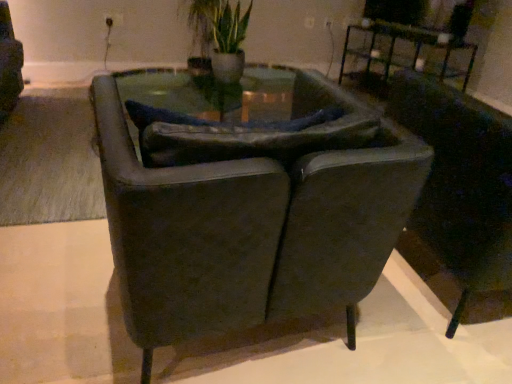
Question: From a real-world perspective, is suede-like dark brown armchair at center, the first chair viewed from the left, beneath green leafy plant at upper center?

Choices:
 (A) yes
 (B) no

Answer: (A)

Question: Is suede-like dark brown armchair at center, the second chair positioned from the right, positioned with its back to green leafy plant at upper center?

Choices:
 (A) no
 (B) yes

Answer: (A)

Question: Is suede-like dark brown armchair at center, the first chair viewed from the left, behind green leafy plant at upper center?

Choices:
 (A) no
 (B) yes

Answer: (A)

Question: Considering the relative sizes of suede-like dark brown armchair at center, the second chair positioned from the right, and green leafy plant at upper center in the image provided, is suede-like dark brown armchair at center, the second chair positioned from the right, wider than green leafy plant at upper center?

Choices:
 (A) no
 (B) yes

Answer: (B)

Question: Does suede-like dark brown armchair at center, the second chair positioned from the right, have a lesser width compared to green leafy plant at upper center?

Choices:
 (A) yes
 (B) no

Answer: (B)

Question: From the image's perspective, does suede-like dark brown armchair at center, the first chair viewed from the left, appear lower than green leafy plant at upper center?

Choices:
 (A) no
 (B) yes

Answer: (B)

Question: From the image's perspective, is metallic black table at upper right on dark leather chair at right, the second chair in the left-to-right sequence?

Choices:
 (A) no
 (B) yes

Answer: (B)

Question: Is metallic black table at upper right turned away from dark leather chair at right, the second chair in the left-to-right sequence?

Choices:
 (A) yes
 (B) no

Answer: (B)

Question: Does metallic black table at upper right have a greater width compared to dark leather chair at right, which ranks as the 1th chair in right-to-left order?

Choices:
 (A) yes
 (B) no

Answer: (B)

Question: From the image's perspective, is metallic black table at upper right under dark leather chair at right, which ranks as the 1th chair in right-to-left order?

Choices:
 (A) yes
 (B) no

Answer: (B)

Question: Considering the relative sizes of metallic black table at upper right and dark leather chair at right, the second chair in the left-to-right sequence, in the image provided, is metallic black table at upper right taller than dark leather chair at right, the second chair in the left-to-right sequence,?

Choices:
 (A) no
 (B) yes

Answer: (A)

Question: Would you say metallic black table at upper right is outside dark leather chair at right, which ranks as the 1th chair in right-to-left order?

Choices:
 (A) no
 (B) yes

Answer: (B)

Question: Does dark leather chair at right, which ranks as the 1th chair in right-to-left order, lie behind green leafy plant at upper center?

Choices:
 (A) no
 (B) yes

Answer: (A)